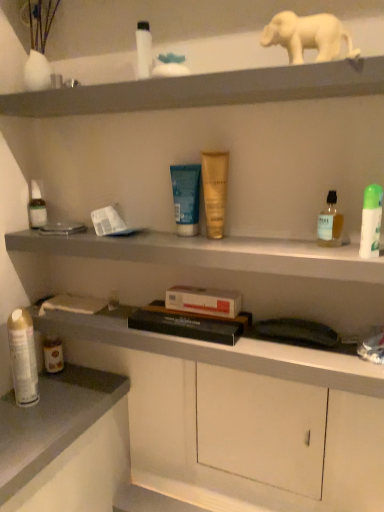
Question: Considering the positions of point (31, 358) and point (29, 224), is point (31, 358) closer or farther from the camera than point (29, 224)?

Choices:
 (A) closer
 (B) farther

Answer: (A)

Question: Is metallic silver spray can at lower left, the 2th toiletry viewed from the back, inside or outside of translucent plastic bottle at left, the 6th toiletry positioned from the right?

Choices:
 (A) outside
 (B) inside

Answer: (A)

Question: Which is farther from the white matte elephant at upper center?

Choices:
 (A) smooth gray countertop at lower left
 (B) gold matte tube at center, which appears as the 3th toiletry when viewed from the right
 (C) hardcover book at center
 (D) metallic silver spray can at lower left, which is the 5th toiletry from front to back
 (E) blue matte tube at center, the fourth toiletry positioned from the right

Answer: (A)

Question: Which object is the closest to the metallic gray shelf at lower left, positioned as the 2th shelf in top-to-bottom order?

Choices:
 (A) green plastic deodorant at right, arranged as the sixth toiletry when viewed from the left
 (B) gold matte tube at center, which is the fourth toiletry from back to front
 (C) smooth gray countertop at lower left
 (D) hardcover book at center
 (E) clear glass bottle at upper right, which appears as the 2th toiletry when viewed from the front

Answer: (D)